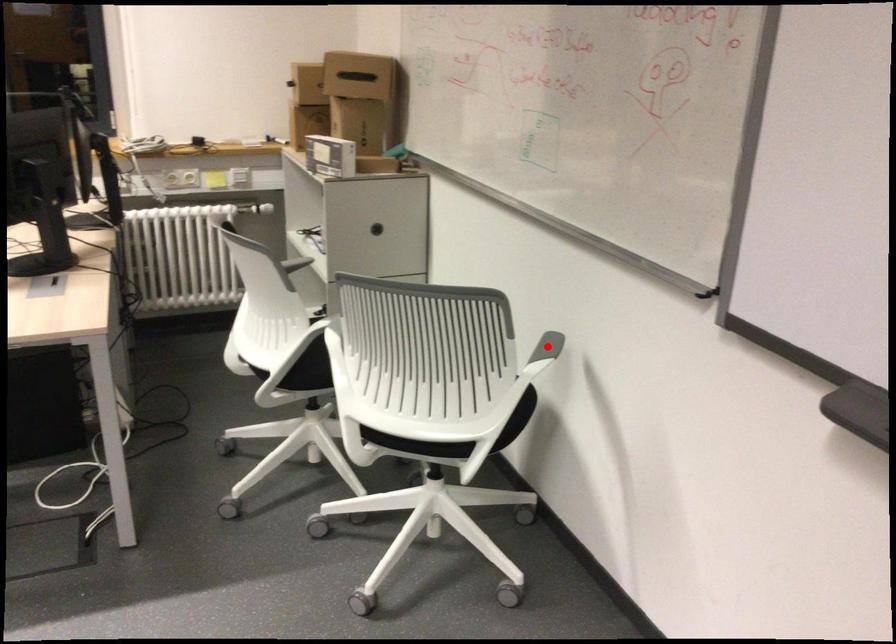
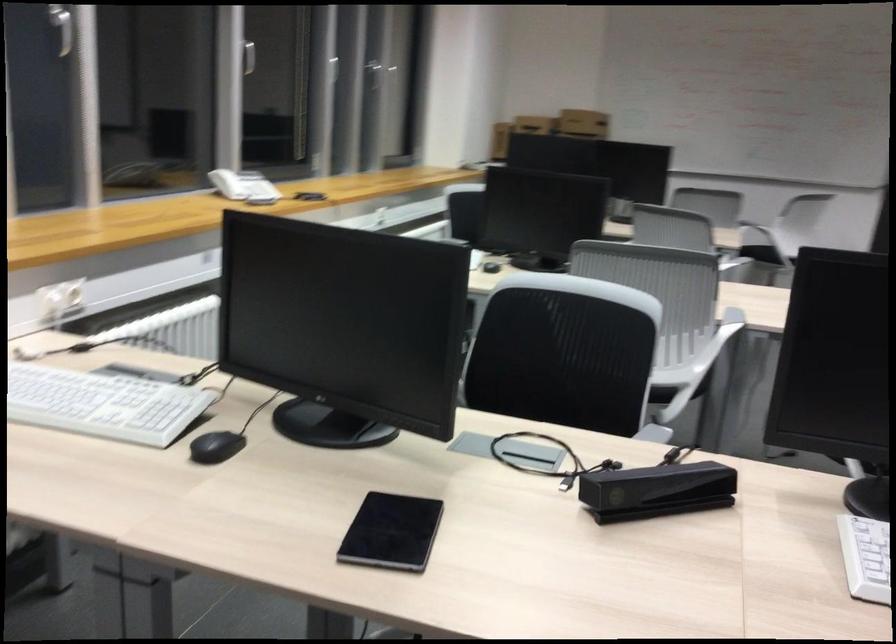
Question: I am providing you with two images of the same scene from different viewpoints. A red point is marked on the first image. Can you still see the location of the red point in image 2?

Choices:
 (A) Yes
 (B) No

Answer: (B)